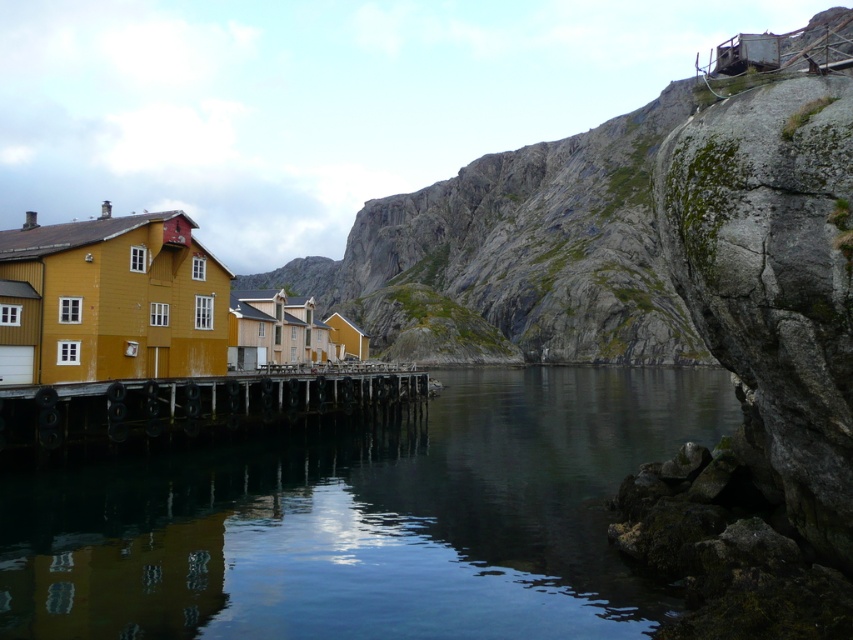
Is clear water at center below wooden planks at center?

Indeed, clear water at center is positioned under wooden planks at center.

Who is lower down, clear water at center or wooden planks at center?

clear water at center is below.

I want to click on clear water at center, so pyautogui.click(x=364, y=518).